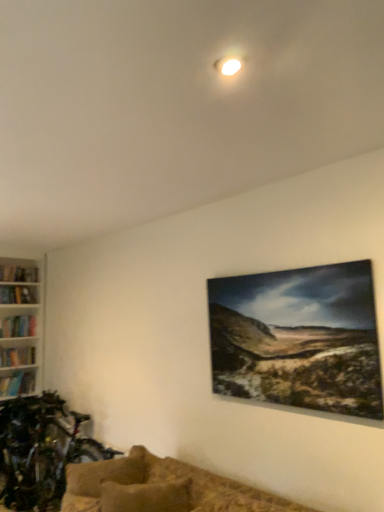
Question: Would you say brown textured couch at lower center is outside textured beige pillow at lower center?

Choices:
 (A) yes
 (B) no

Answer: (A)

Question: Is brown textured couch at lower center oriented away from textured beige pillow at lower center?

Choices:
 (A) yes
 (B) no

Answer: (B)

Question: Is brown textured couch at lower center smaller than textured beige pillow at lower center?

Choices:
 (A) yes
 (B) no

Answer: (B)

Question: From the image's perspective, would you say brown textured couch at lower center is positioned over textured beige pillow at lower center?

Choices:
 (A) yes
 (B) no

Answer: (B)

Question: From the image's perspective, is brown textured couch at lower center under textured beige pillow at lower center?

Choices:
 (A) no
 (B) yes

Answer: (B)

Question: Is brown textured couch at lower center at the left side of textured beige pillow at lower center?

Choices:
 (A) yes
 (B) no

Answer: (A)

Question: Is brown textured couch at lower center located within textured beige pillow at lower center?

Choices:
 (A) no
 (B) yes

Answer: (A)

Question: Is textured beige pillow at lower center looking in the opposite direction of brown textured couch at lower center?

Choices:
 (A) yes
 (B) no

Answer: (A)

Question: Does textured beige pillow at lower center have a greater width compared to brown textured couch at lower center?

Choices:
 (A) no
 (B) yes

Answer: (A)

Question: Would you say textured beige pillow at lower center is outside brown textured couch at lower center?

Choices:
 (A) no
 (B) yes

Answer: (A)

Question: Is textured beige pillow at lower center behind brown textured couch at lower center?

Choices:
 (A) no
 (B) yes

Answer: (A)

Question: From a real-world perspective, is textured beige pillow at lower center on top of brown textured couch at lower center?

Choices:
 (A) no
 (B) yes

Answer: (A)

Question: Is brown textured couch at lower center located within shiny metallic bicycle at lower left?

Choices:
 (A) no
 (B) yes

Answer: (A)